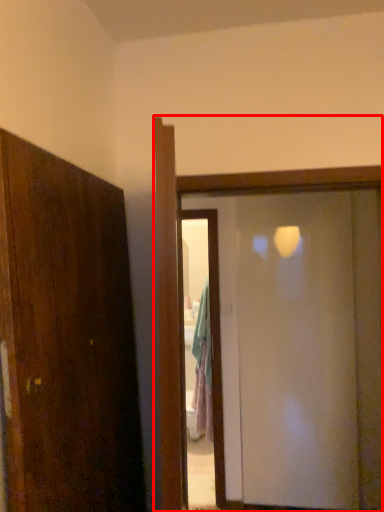
Question: Where is door (annotated by the red box) located in relation to screen door in the image?

Choices:
 (A) right
 (B) left

Answer: (B)